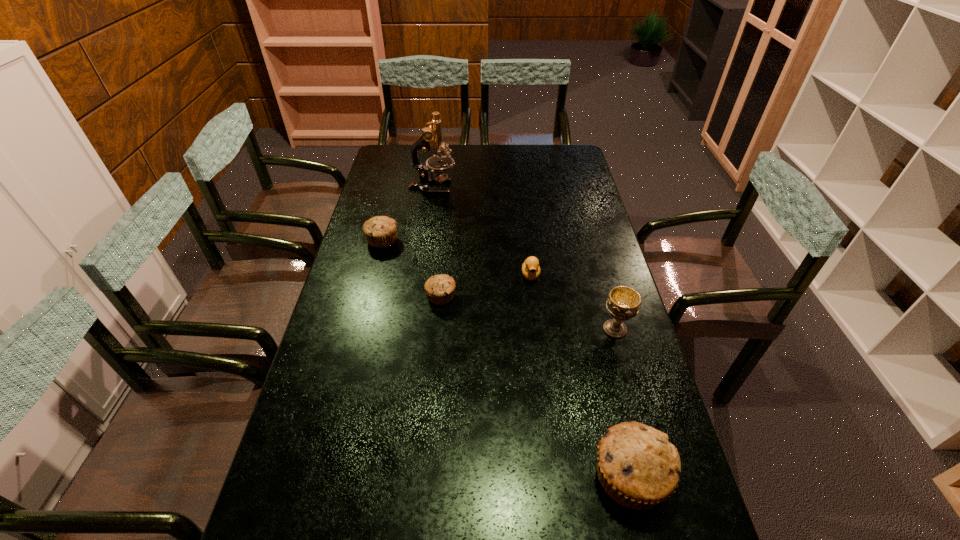
Image resolution: width=960 pixels, height=540 pixels. I want to click on muffin that is the nearest to the tallest object, so click(380, 231).

Locate which muffin ranks third in proximity to the third object from right to left. Please provide its 2D coordinates. Your answer should be formatted as a tuple, i.e. [(x, y)], where the tuple contains the x and y coordinates of a point satisfying the conditions above.

[(638, 467)]

Identify the location of vacant region that satisfies the following two spatial constraints: 1. on the back side of the chalice; 2. at the eyepiece of the farthest object. (575, 187).

I want to click on vacant space that satisfies the following two spatial constraints: 1. at the eyepiece of the nearest muffin; 2. on the right side of the farthest object, so click(x=392, y=477).

At what (x,y) coordinates should I click in order to perform the action: click on blank space that satisfies the following two spatial constraints: 1. facing forward on the fourth object from left to right; 2. on the left side of the chalice. Please return your answer as a coordinate pair (x, y). Looking at the image, I should click on (538, 329).

I want to click on vacant space that satisfies the following two spatial constraints: 1. at the eyepiece of the fifth farthest object; 2. on the left side of the tallest object, so click(412, 329).

Locate an element on the screen. The image size is (960, 540). free region that satisfies the following two spatial constraints: 1. at the eyepiece of the microscope; 2. on the left side of the second farthest muffin is located at coordinates (417, 296).